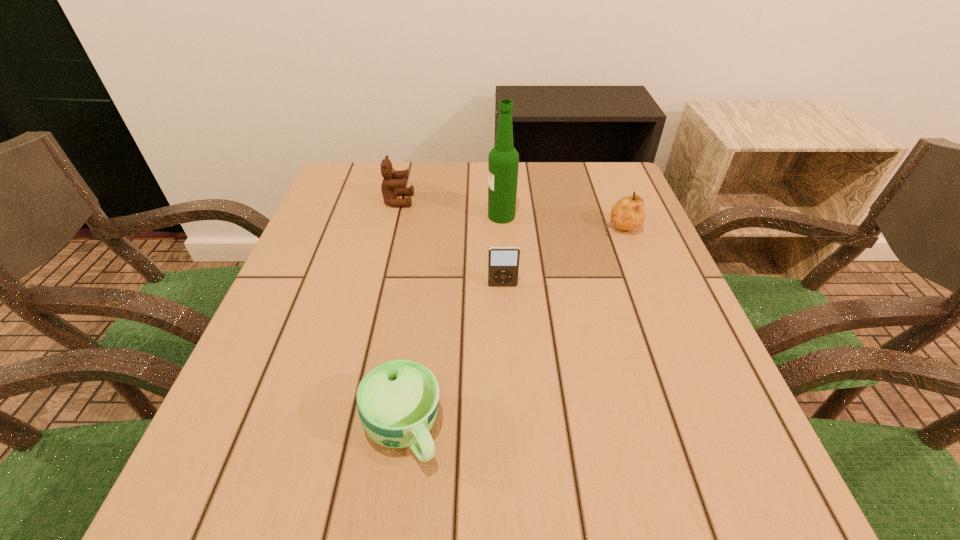
What are the coordinates of `vacant space located 0.060m on the front-facing side of the iPod` in the screenshot? It's located at (504, 309).

Locate an element on the screen. The image size is (960, 540). vacant space located 0.240m on the back of the cup is located at coordinates (422, 287).

The height and width of the screenshot is (540, 960). What are the coordinates of `beer bottle situated at the far edge` in the screenshot? It's located at (503, 161).

Identify the location of teddy bear located at the far edge. (394, 184).

Where is `object situated at the near edge`? The width and height of the screenshot is (960, 540). object situated at the near edge is located at coordinates (397, 400).

Where is `object that is positioned at the left edge`? object that is positioned at the left edge is located at coordinates (394, 184).

This screenshot has width=960, height=540. Identify the location of object positioned at the right edge. (628, 213).

The image size is (960, 540). Identify the location of object positioned at the far left corner. (394, 184).

Identify the location of vacant space at the far edge of the desktop. (428, 162).

Locate an element on the screen. free location at the near edge of the desktop is located at coordinates (518, 504).